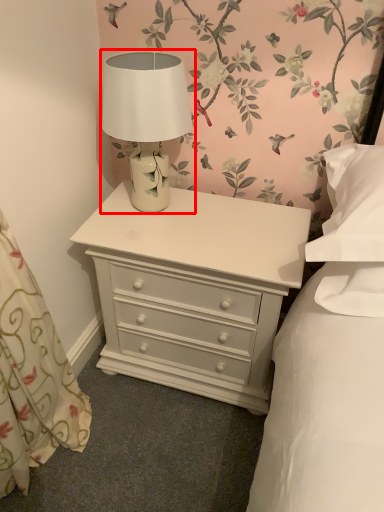
Question: From the image's perspective, what is the correct spatial relationship of table lamp (annotated by the red box) in relation to nightstand?

Choices:
 (A) below
 (B) above

Answer: (B)